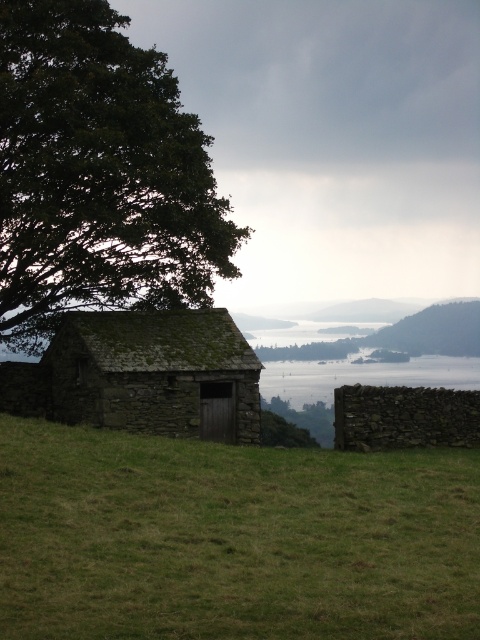
Which is more to the right, rusty stone hut at center or green mossy tree at upper center?

From the viewer's perspective, green mossy tree at upper center appears more on the right side.

Can you confirm if rusty stone hut at center is positioned below green mossy tree at upper center?

Actually, rusty stone hut at center is above green mossy tree at upper center.

Find the location of a particular element. The width and height of the screenshot is (480, 640). rusty stone hut at center is located at coordinates (153, 371).

Identify the location of rusty stone hut at center. The height and width of the screenshot is (640, 480). (153, 371).

Which is more to the left, dark green leafy tree at upper left or green mossy tree at upper center?

dark green leafy tree at upper left

Who is more distant from viewer, (x=132, y=308) or (x=262, y=349)?

The point (x=262, y=349) is more distant.

Which is behind, point (113, 64) or point (379, 339)?

The point (379, 339) is more distant.

Locate an element on the screen. This screenshot has height=640, width=480. dark green leafy tree at upper left is located at coordinates (98, 176).

Does point (52, 461) lie behind point (302, 344)?

No, (52, 461) is closer to viewer.

Does green grassy field at lower center have a lesser width compared to green mossy tree at upper center?

Yes.

Find the location of `green grassy field at lower center`. green grassy field at lower center is located at coordinates (231, 538).